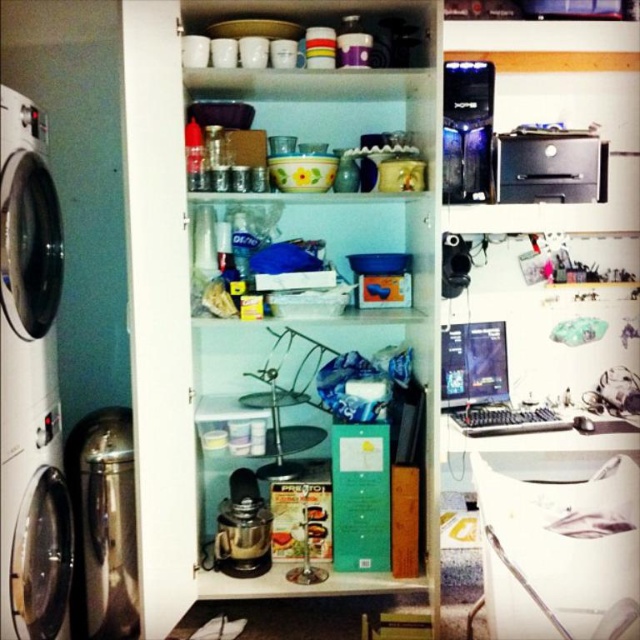
Question: Is white glossy washing machine at left closer to the viewer compared to brushed metal dish washer at left?

Choices:
 (A) yes
 (B) no

Answer: (A)

Question: Which point is closer to the camera?

Choices:
 (A) (170, 577)
 (B) (56, 301)
 (C) (92, 481)

Answer: (B)

Question: Is matte plastic container at upper center bigger than white glossy washing machine at left?

Choices:
 (A) yes
 (B) no

Answer: (A)

Question: Among these objects, which one is farthest from the camera?

Choices:
 (A) matte plastic container at upper center
 (B) brushed metal dish washer at left
 (C) brushed metal washing machine at left
 (D) white glossy washing machine at left

Answer: (B)

Question: Can you confirm if brushed metal dish washer at left is bigger than black plastic printer at upper right?

Choices:
 (A) no
 (B) yes

Answer: (B)

Question: Which of the following is the farthest from the observer?

Choices:
 (A) (179, 109)
 (B) (4, 460)
 (C) (104, 621)
 (D) (58, 221)

Answer: (C)